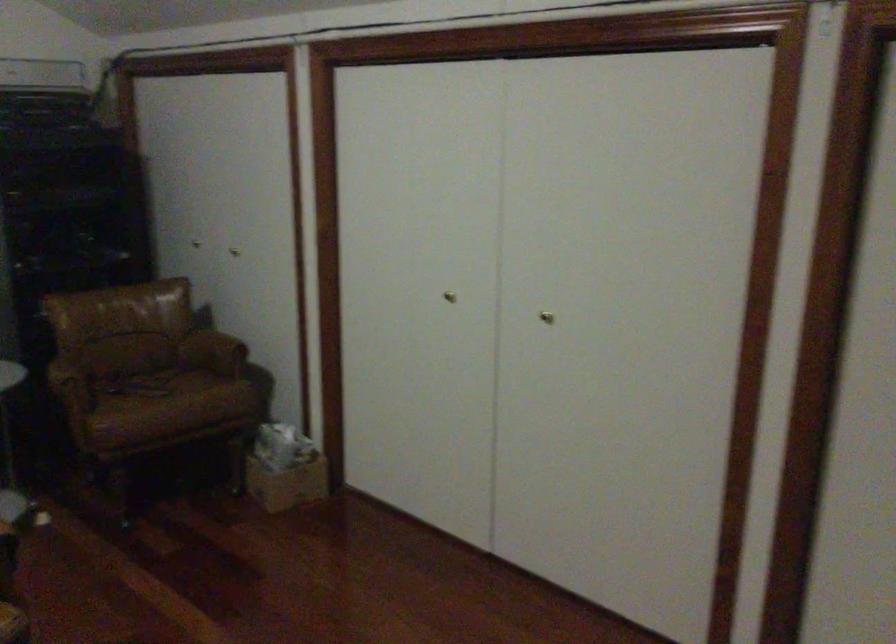
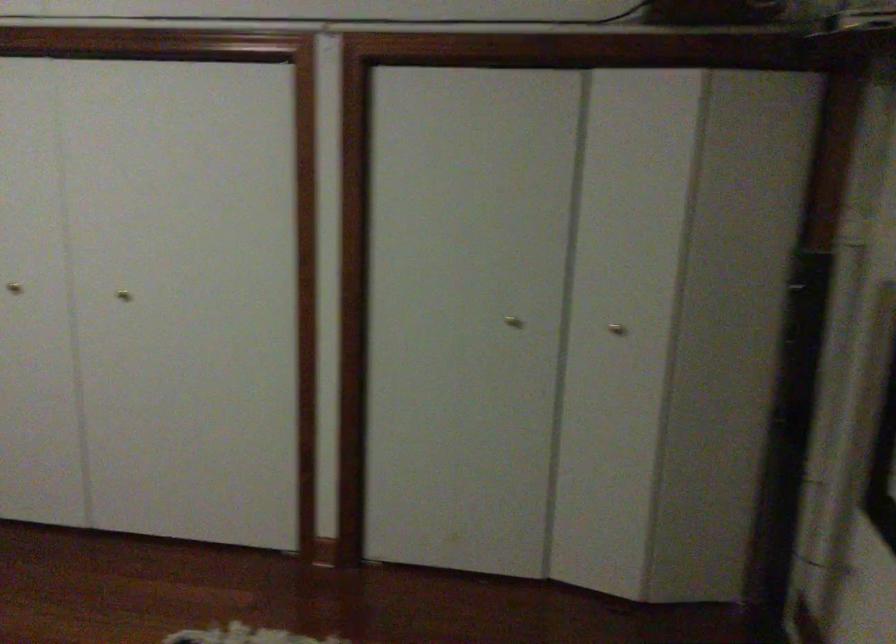
Question: The camera is either moving clockwise (left) or counter-clockwise (right) around the object. The first image is from the beginning of the video and the second image is from the end. Is the camera moving left or right when shooting the video?

Choices:
 (A) Left
 (B) Right

Answer: (A)